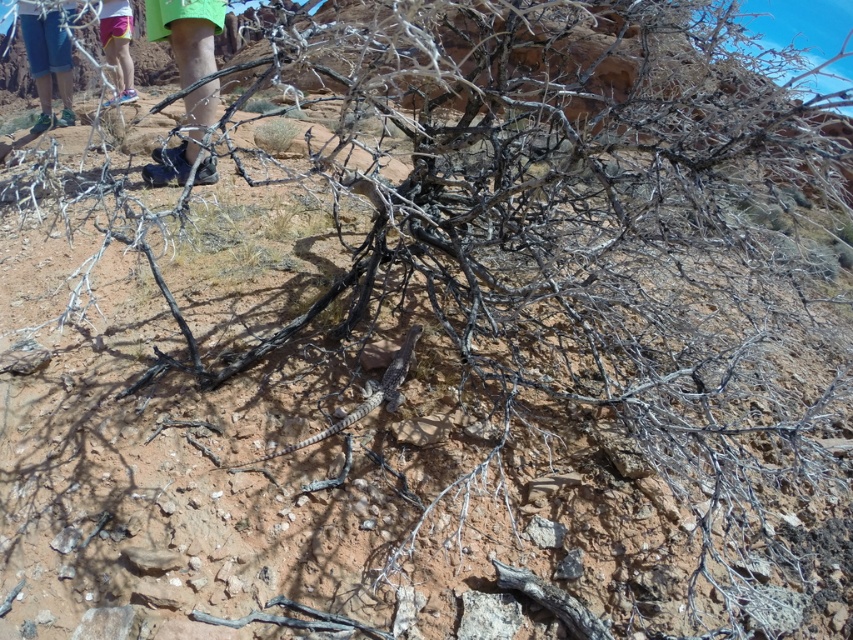
You are a photographer setting up a tripod in the desert scene. You need to place the tripod between the black leather shoe at upper left and the pink fabric shorts at upper left. Considering their sizes, which object should the tripod be closer to to ensure stability?

The black leather shoe at upper left has a larger width than the pink fabric shorts at upper left, so the tripod should be placed closer to the black leather shoe at upper left for better stability due to its wider base.